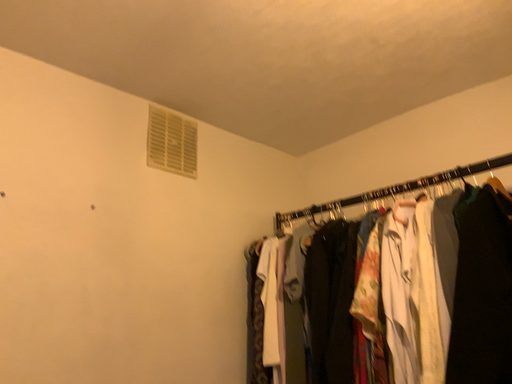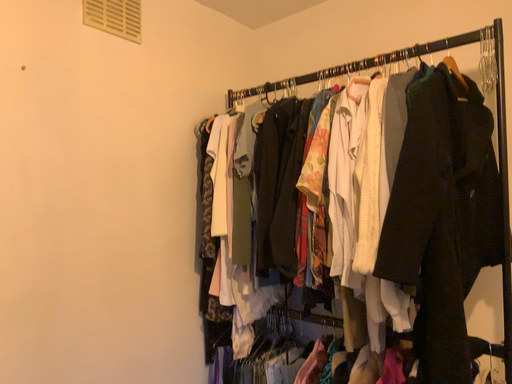
Question: Which way did the camera rotate in the video?

Choices:
 (A) rotated upward
 (B) rotated downward

Answer: (B)